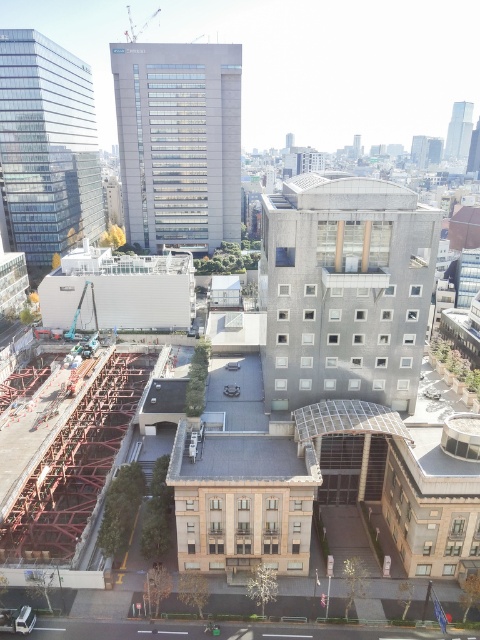
Who is lower down, slate gray concrete building at center or gray concrete building at center?

slate gray concrete building at center is lower down.

Which is behind, point (312, 184) or point (132, 125)?

The point (132, 125) is more distant.

This screenshot has width=480, height=640. I want to click on slate gray concrete building at center, so 345,289.